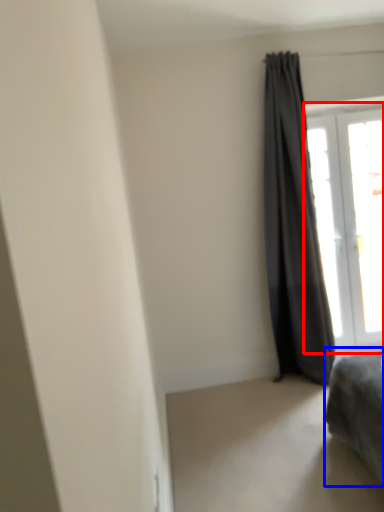
Question: Which of the following is the farthest to the observer, window (highlighted by a red box) or furniture (highlighted by a blue box)?

Choices:
 (A) window
 (B) furniture

Answer: (A)